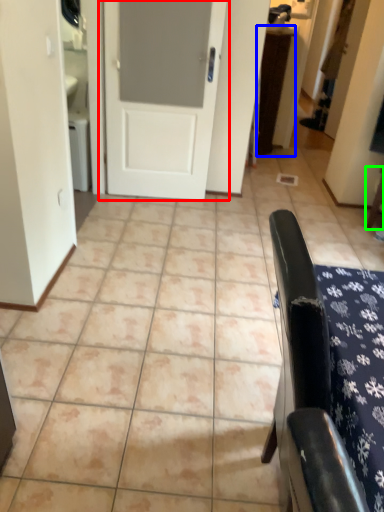
Question: Based on their relative distances, which object is nearer to door (highlighted by a red box)? Choose from table (highlighted by a blue box) and furniture (highlighted by a green box).

Choices:
 (A) table
 (B) furniture

Answer: (A)